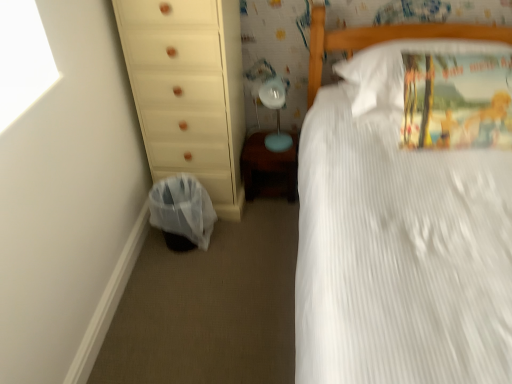
In order to click on vacant space in wooden changing table at lower center (from a real-world perspective) in this screenshot , I will do `click(268, 192)`.